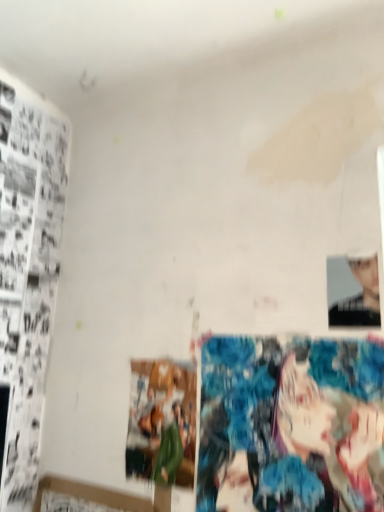
Image resolution: width=384 pixels, height=512 pixels. Describe the element at coordinates (162, 422) in the screenshot. I see `matte paper print at center` at that location.

The width and height of the screenshot is (384, 512). In order to click on matte paper print at center in this screenshot , I will do 162,422.

Who is bigger, colorful fabric art at lower right or smooth black portrait at upper right?

Bigger between the two is colorful fabric art at lower right.

You are a GUI agent. You are given a task and a screenshot of the screen. Output one action in this format:
    pyautogui.click(x=<x>, y=<y>)
    Task: Click on the person lying above the colorful fabric art at lower right (from the image's perspective)
    
    Given the screenshot: What is the action you would take?
    pyautogui.click(x=353, y=293)

Would you consider colorful fabric art at lower right to be distant from smooth black portrait at upper right?

No, colorful fabric art at lower right is in close proximity to smooth black portrait at upper right.

Which is more to the left, colorful fabric art at lower right or smooth black portrait at upper right?

From the viewer's perspective, colorful fabric art at lower right appears more on the left side.

Are matte paper print at center and smooth black portrait at upper right beside each other?

They are not placed beside each other.

Measure the distance between matte paper print at center and smooth black portrait at upper right.

46.41 centimeters.

The width and height of the screenshot is (384, 512). I want to click on print behind the smooth black portrait at upper right, so click(162, 422).

Considering the sizes of matte paper print at center and smooth black portrait at upper right in the image, is matte paper print at center taller or shorter than smooth black portrait at upper right?

Considering their sizes, matte paper print at center has more height than smooth black portrait at upper right.

Who is taller, smooth black portrait at upper right or matte paper print at center?

With more height is matte paper print at center.

How different are the orientations of smooth black portrait at upper right and matte paper print at center in degrees?

They differ by 1.78 degrees in their facing directions.

Is smooth black portrait at upper right turned away from matte paper print at center?

No.

Is smooth black portrait at upper right thinner than matte paper print at center?

Correct, the width of smooth black portrait at upper right is less than that of matte paper print at center.

Relative to colorful fabric art at lower right, is smooth black portrait at upper right in front or behind?

Visually, smooth black portrait at upper right is located behind colorful fabric art at lower right.

From the image's perspective, does smooth black portrait at upper right appear higher than colorful fabric art at lower right?

Indeed, from the image's perspective, smooth black portrait at upper right is shown above colorful fabric art at lower right.

Where is `reflection directly beneath the smooth black portrait at upper right (from a real-world perspective)`? reflection directly beneath the smooth black portrait at upper right (from a real-world perspective) is located at coordinates (291, 424).

How different are the orientations of smooth black portrait at upper right and colorful fabric art at lower right in degrees?

The angular difference between smooth black portrait at upper right and colorful fabric art at lower right is 0.299 degrees.

Locate an element on the screen. The width and height of the screenshot is (384, 512). reflection that appears above the matte paper print at center (from the image's perspective) is located at coordinates (291, 424).

Looking at this image, is matte paper print at center not close to colorful fabric art at lower right?

matte paper print at center is near colorful fabric art at lower right, not far away.

From the image's perspective, does matte paper print at center appear lower than colorful fabric art at lower right?

Indeed, from the image's perspective, matte paper print at center is shown beneath colorful fabric art at lower right.

Is colorful fabric art at lower right positioned beyond the bounds of matte paper print at center?

Absolutely, colorful fabric art at lower right is external to matte paper print at center.

From the image's perspective, is colorful fabric art at lower right under matte paper print at center?

No, from the image's perspective, colorful fabric art at lower right is not beneath matte paper print at center.

Is colorful fabric art at lower right to the right of matte paper print at center from the viewer's perspective?

Correct, you'll find colorful fabric art at lower right to the right of matte paper print at center.

Find the location of a particular element. person behind the colorful fabric art at lower right is located at coordinates (353, 293).

Find the location of a particular element. person above the matte paper print at center (from the image's perspective) is located at coordinates (353, 293).

Looking at the image, which one is located further to smooth black portrait at upper right, colorful fabric art at lower right or matte paper print at center?

matte paper print at center lies further to smooth black portrait at upper right than the other object.

Considering their positions, is matte paper print at center positioned closer to smooth black portrait at upper right than colorful fabric art at lower right?

Based on the image, colorful fabric art at lower right appears to be nearer to smooth black portrait at upper right.

Looking at the image, which one is located closer to colorful fabric art at lower right, matte paper print at center or smooth black portrait at upper right?

matte paper print at center is closer to colorful fabric art at lower right.

Which object lies further to the anchor point matte paper print at center, colorful fabric art at lower right or smooth black portrait at upper right?

smooth black portrait at upper right lies further to matte paper print at center than the other object.

Estimate the real-world distances between objects in this image. Which object is further from matte paper print at center, smooth black portrait at upper right or colorful fabric art at lower right?

smooth black portrait at upper right lies further to matte paper print at center than the other object.

From the image, which object appears to be farther from colorful fabric art at lower right, smooth black portrait at upper right or matte paper print at center?

The object further to colorful fabric art at lower right is smooth black portrait at upper right.

You are a GUI agent. You are given a task and a screenshot of the screen. Output one action in this format:
    pyautogui.click(x=<x>, y=<y>)
    Task: Click on the reflection between matte paper print at center and smooth black portrait at upper right in the horizontal direction
    
    Given the screenshot: What is the action you would take?
    pyautogui.click(x=291, y=424)